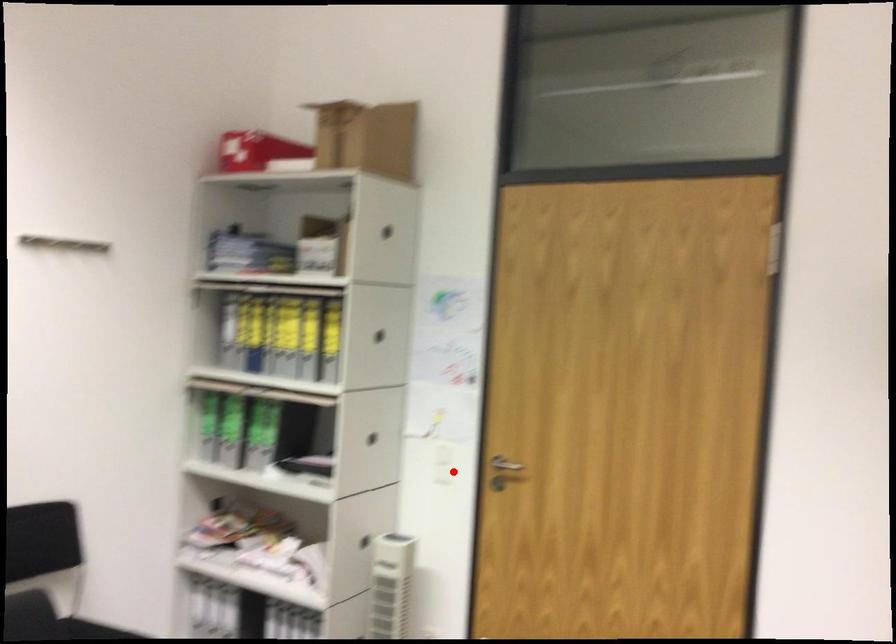
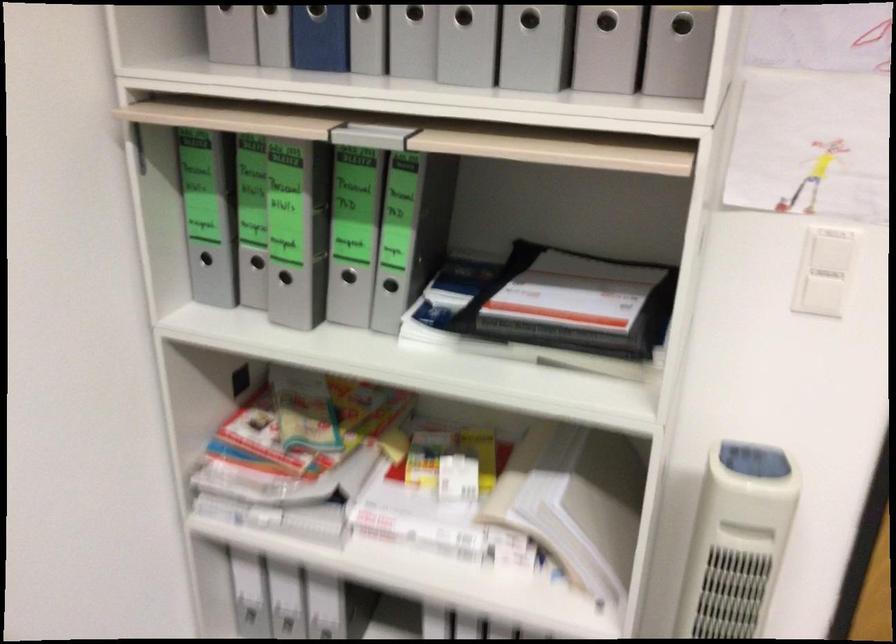
Locate, in the second image, the point that corresponds to the highlighted location in the first image.

(823, 295)